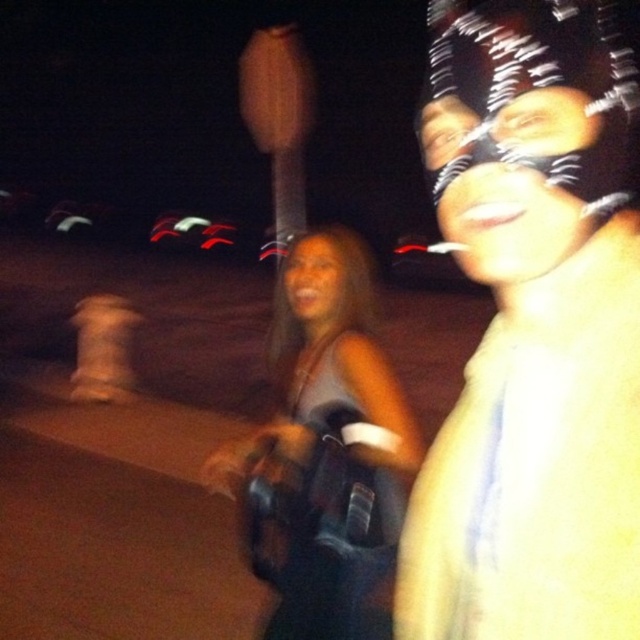
You are a photographer who just took a nighttime photo of two people. In the image, you notice the satin brown dress at center and the matte skin tone face at center. Based on their positions, which object is closer to the bottom of the image?

The satin brown dress at center is located below the matte skin tone face at center, so it is closer to the bottom of the image.

You are a photographer reviewing a nighttime photo where two people are blurred due to motion. You notice a shiny metallic face mask at center and a matte skin tone face at center. Which object is closer to the camera?

The shiny metallic face mask at center is closer to the camera because it is in front of the matte skin tone face at center.